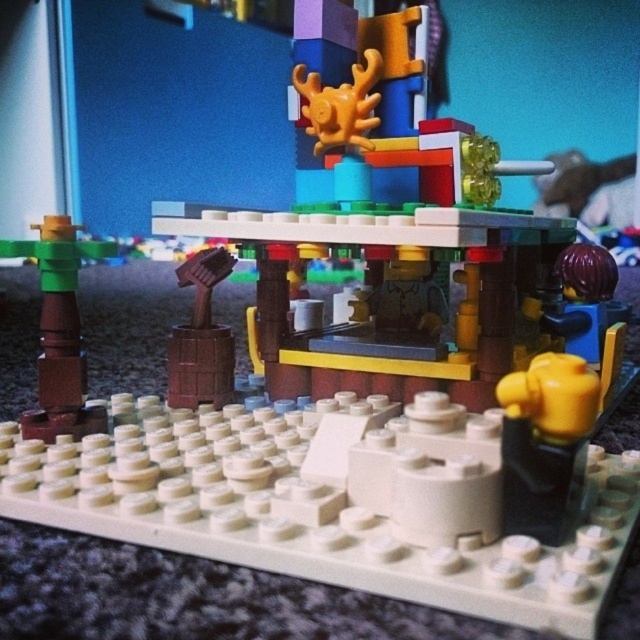
Question: Can you confirm if brown matte post at left is wider than wooden barrel at center?

Choices:
 (A) no
 (B) yes

Answer: (B)

Question: Does brown matte post at left appear under wooden barrel at center?

Choices:
 (A) yes
 (B) no

Answer: (B)

Question: Can you confirm if brown matte post at left is thinner than wooden barrel at center?

Choices:
 (A) no
 (B) yes

Answer: (A)